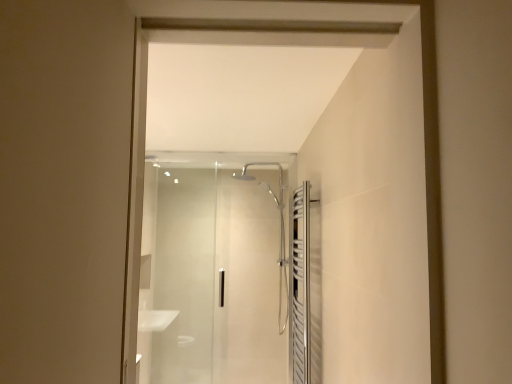
Question: From a real-world perspective, relative to polished stainless steel towel rack at right, the second screen door from the back, is transparent glass shower door at center, the second screen door in the right-to-left sequence, vertically above or below?

Choices:
 (A) below
 (B) above

Answer: (B)

Question: In the image, is transparent glass shower door at center, the second screen door in the right-to-left sequence, positioned in front of or behind polished stainless steel towel rack at right, positioned as the first screen door in front-to-back order?

Choices:
 (A) front
 (B) behind

Answer: (B)

Question: In terms of size, does transparent glass shower door at center, the second screen door in the right-to-left sequence, appear bigger or smaller than polished stainless steel towel rack at right, marked as the 2th screen door in a left-to-right arrangement?

Choices:
 (A) small
 (B) big

Answer: (B)

Question: In terms of height, does polished stainless steel towel rack at right, the second screen door from the back, look taller or shorter compared to transparent glass shower door at center, which is the first screen door in back-to-front order?

Choices:
 (A) tall
 (B) short

Answer: (B)

Question: Looking at their shapes, would you say polished stainless steel towel rack at right, positioned as the first screen door in front-to-back order, is wider or thinner than transparent glass shower door at center, which is the first screen door in back-to-front order?

Choices:
 (A) wide
 (B) thin

Answer: (A)

Question: Considering their positions, is polished stainless steel towel rack at right, positioned as the first screen door in front-to-back order, located in front of or behind transparent glass shower door at center, the second screen door in the right-to-left sequence?

Choices:
 (A) behind
 (B) front

Answer: (B)

Question: Based on their sizes in the image, would you say polished stainless steel towel rack at right, the second screen door from the back, is bigger or smaller than transparent glass shower door at center, which is the first screen door in back-to-front order?

Choices:
 (A) small
 (B) big

Answer: (A)